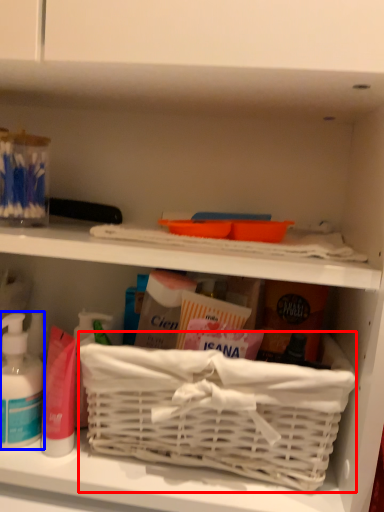
Question: Which object appears farthest to the camera in this image, basket container (highlighted by a red box) or cleaning product (highlighted by a blue box)?

Choices:
 (A) basket container
 (B) cleaning product

Answer: (B)